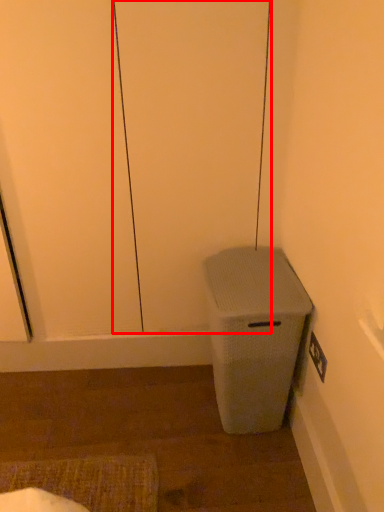
Question: In this image, where is screen door (annotated by the red box) located relative to waste container?

Choices:
 (A) right
 (B) left

Answer: (B)